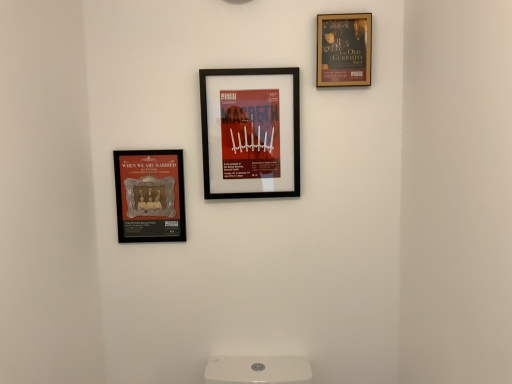
Question: Is matte gold plaque at left, the first picture frame positioned from the left, not within gold-framed poster at upper right, which ranks as the 3th picture frame in left-to-right order?

Choices:
 (A) no
 (B) yes

Answer: (B)

Question: Does matte gold plaque at left, the 3th picture frame when ordered from right to left, appear on the right side of gold-framed poster at upper right, which ranks as the 3th picture frame in left-to-right order?

Choices:
 (A) no
 (B) yes

Answer: (A)

Question: From the image's perspective, does matte gold plaque at left, the 3th picture frame when ordered from right to left, appear higher than gold-framed poster at upper right, the first picture frame positioned from the right?

Choices:
 (A) no
 (B) yes

Answer: (A)

Question: Considering the relative positions of matte gold plaque at left, the first picture frame positioned from the left, and gold-framed poster at upper right, which ranks as the 3th picture frame in left-to-right order, in the image provided, is matte gold plaque at left, the first picture frame positioned from the left, in front of gold-framed poster at upper right, which ranks as the 3th picture frame in left-to-right order,?

Choices:
 (A) yes
 (B) no

Answer: (B)

Question: From the image's perspective, does matte gold plaque at left, the first picture frame positioned from the left, appear lower than gold-framed poster at upper right, the first picture frame positioned from the right?

Choices:
 (A) yes
 (B) no

Answer: (A)

Question: In terms of size, does gold-framed poster at upper right, the first picture frame positioned from the right, appear bigger or smaller than matte gold plaque at left, the 3th picture frame when ordered from right to left?

Choices:
 (A) big
 (B) small

Answer: (B)

Question: Visually, is gold-framed poster at upper right, the first picture frame positioned from the right, positioned to the left or to the right of matte gold plaque at left, the first picture frame positioned from the left?

Choices:
 (A) left
 (B) right

Answer: (B)

Question: From the image's perspective, is gold-framed poster at upper right, which ranks as the 3th picture frame in left-to-right order, located above or below matte gold plaque at left, the first picture frame positioned from the left?

Choices:
 (A) above
 (B) below

Answer: (A)

Question: In terms of height, does gold-framed poster at upper right, which ranks as the 3th picture frame in left-to-right order, look taller or shorter compared to matte gold plaque at left, the 3th picture frame when ordered from right to left?

Choices:
 (A) tall
 (B) short

Answer: (B)

Question: From a real-world perspective, is matte gold plaque at left, the first picture frame positioned from the left, physically located above or below matte black picture frame at center, marked as the 2th picture frame in a right-to-left arrangement?

Choices:
 (A) above
 (B) below

Answer: (B)

Question: In terms of width, does matte gold plaque at left, the first picture frame positioned from the left, look wider or thinner when compared to matte black picture frame at center, acting as the second picture frame starting from the left?

Choices:
 (A) thin
 (B) wide

Answer: (A)

Question: In terms of height, does matte gold plaque at left, the 3th picture frame when ordered from right to left, look taller or shorter compared to matte black picture frame at center, acting as the second picture frame starting from the left?

Choices:
 (A) tall
 (B) short

Answer: (B)

Question: Considering the positions of matte gold plaque at left, the first picture frame positioned from the left, and matte black picture frame at center, marked as the 2th picture frame in a right-to-left arrangement, in the image, is matte gold plaque at left, the first picture frame positioned from the left, bigger or smaller than matte black picture frame at center, marked as the 2th picture frame in a right-to-left arrangement,?

Choices:
 (A) big
 (B) small

Answer: (B)

Question: Considering the relative positions of gold-framed poster at upper right, which ranks as the 3th picture frame in left-to-right order, and matte black picture frame at center, acting as the second picture frame starting from the left, in the image provided, is gold-framed poster at upper right, which ranks as the 3th picture frame in left-to-right order, to the left or to the right of matte black picture frame at center, acting as the second picture frame starting from the left,?

Choices:
 (A) right
 (B) left

Answer: (A)

Question: From a real-world perspective, is gold-framed poster at upper right, which ranks as the 3th picture frame in left-to-right order, physically located above or below matte black picture frame at center, marked as the 2th picture frame in a right-to-left arrangement?

Choices:
 (A) above
 (B) below

Answer: (A)